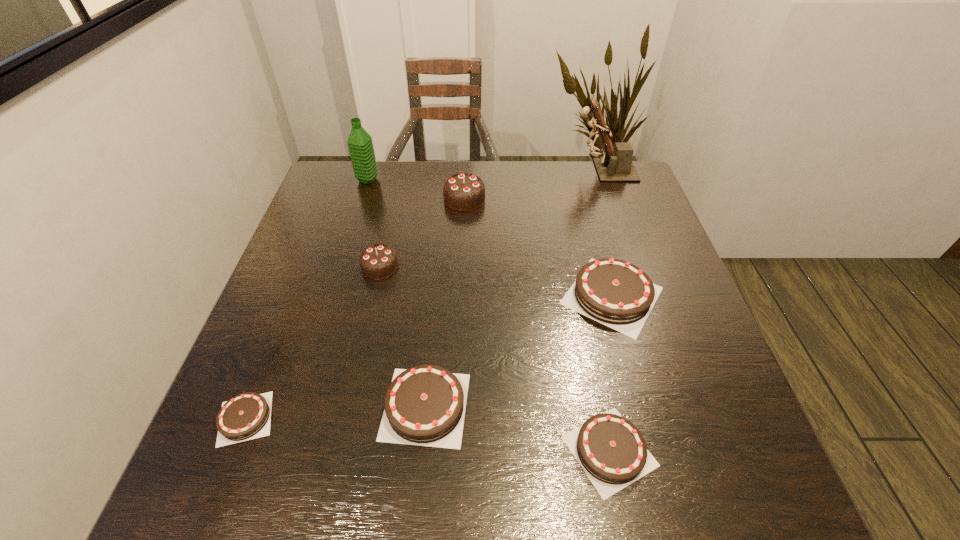
The image size is (960, 540). In order to click on figurine in this screenshot , I will do `click(615, 164)`.

At what (x,y) coordinates should I click in order to perform the action: click on brown figurine. Please return your answer as a coordinate pair (x, y). This screenshot has width=960, height=540. Looking at the image, I should click on (615, 164).

Where is `the seventh shortest object`? The image size is (960, 540). the seventh shortest object is located at coordinates (360, 144).

Identify the location of green water bottle. The width and height of the screenshot is (960, 540). (360, 144).

The width and height of the screenshot is (960, 540). I want to click on the sixth nearest object, so click(x=463, y=192).

In order to click on the farther chocolate chocolate cake in this screenshot , I will do `click(463, 192)`.

Locate an element on the screen. the nearer chocolate chocolate cake is located at coordinates (379, 261).

I want to click on the left chocolate chocolate cake, so click(379, 261).

This screenshot has width=960, height=540. What are the coordinates of `the biggest brown chocolate cake` in the screenshot? It's located at (618, 294).

Locate an element on the screen. The width and height of the screenshot is (960, 540). the third brown chocolate cake from right to left is located at coordinates (425, 405).